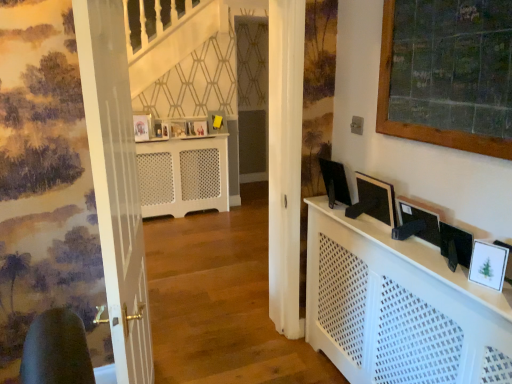
At what (x,y) coordinates should I click in order to perform the action: click on vacant space underneath black glossy monitor at right, placed as the 1th computer monitor when sorted from left to right (from a real-world perspective). Please return your answer as a coordinate pair (x, y). The height and width of the screenshot is (384, 512). Looking at the image, I should click on (332, 200).